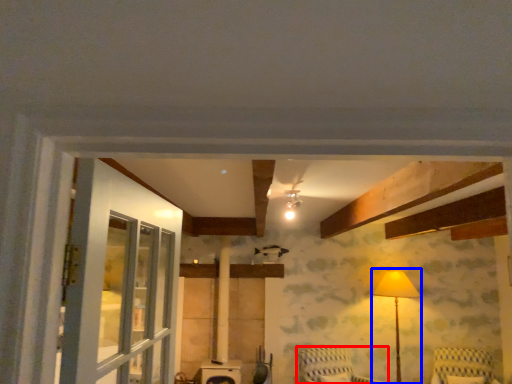
Question: Which of the following is the farthest to the observer, furniture (highlighted by a red box) or table lamp (highlighted by a blue box)?

Choices:
 (A) furniture
 (B) table lamp

Answer: (B)